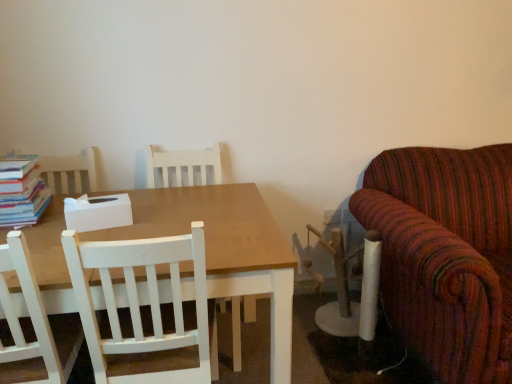
Question: Does hardcover books at left have a larger size compared to white wood chair at center, marked as the first chair in a front-to-back arrangement?

Choices:
 (A) no
 (B) yes

Answer: (A)

Question: From a real-world perspective, is hardcover books at left on white wood chair at center, marked as the first chair in a front-to-back arrangement?

Choices:
 (A) no
 (B) yes

Answer: (B)

Question: Is hardcover books at left looking in the opposite direction of white wood chair at center, which is counted as the 2th chair, starting from the back?

Choices:
 (A) no
 (B) yes

Answer: (A)

Question: Is hardcover books at left in contact with white wood chair at center, marked as the first chair in a front-to-back arrangement?

Choices:
 (A) no
 (B) yes

Answer: (A)

Question: Is hardcover books at left outside white wood chair at center, which is counted as the 2th chair, starting from the back?

Choices:
 (A) yes
 (B) no

Answer: (A)

Question: Considering their positions, is hardcover books at left located in front of or behind white wood chair at center, marked as the first chair in a front-to-back arrangement?

Choices:
 (A) behind
 (B) front

Answer: (A)

Question: Is hardcover books at left spatially inside white wood chair at center, which is counted as the 2th chair, starting from the back, or outside of it?

Choices:
 (A) inside
 (B) outside

Answer: (B)

Question: From a real-world perspective, relative to white wood chair at center, marked as the first chair in a front-to-back arrangement, is hardcover books at left vertically above or below?

Choices:
 (A) below
 (B) above

Answer: (B)

Question: Is point pyautogui.click(x=6, y=192) positioned closer to the camera than point pyautogui.click(x=147, y=324)?

Choices:
 (A) farther
 (B) closer

Answer: (A)

Question: From the image's perspective, is white wood chair at center, the first chair when ordered from back to front, above or below matte wooden table at center?

Choices:
 (A) above
 (B) below

Answer: (A)

Question: Is white wood chair at center, the second chair positioned from the front, taller or shorter than matte wooden table at center?

Choices:
 (A) short
 (B) tall

Answer: (B)

Question: Would you say white wood chair at center, the first chair when ordered from back to front, is to the left or to the right of matte wooden table at center in the picture?

Choices:
 (A) right
 (B) left

Answer: (A)

Question: Is point (168, 150) closer or farther from the camera than point (289, 316)?

Choices:
 (A) closer
 (B) farther

Answer: (B)

Question: From a real-world perspective, is white wood chair at center, which is counted as the 2th chair, starting from the back, physically located above or below white wood chair at center, the second chair positioned from the front?

Choices:
 (A) below
 (B) above

Answer: (B)

Question: Choose the correct answer: Is white wood chair at center, which is counted as the 2th chair, starting from the back, inside white wood chair at center, the second chair positioned from the front, or outside it?

Choices:
 (A) outside
 (B) inside

Answer: (A)